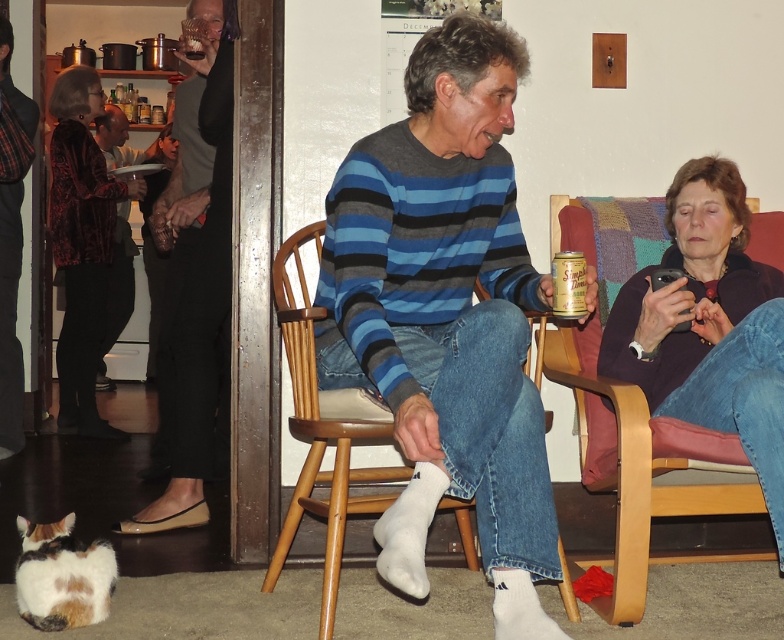
Can you confirm if purple soft sweater at right is positioned above shiny black shoes at lower left?

No.

Between purple soft sweater at right and shiny black shoes at lower left, which one is positioned higher?

shiny black shoes at lower left is higher up.

Where is `purple soft sweater at right`? The width and height of the screenshot is (784, 640). purple soft sweater at right is located at coordinates (708, 326).

Where is `purple soft sweater at right`? The height and width of the screenshot is (640, 784). purple soft sweater at right is located at coordinates (708, 326).

Who is more distant from viewer, (2, 72) or (115, 115)?

Point (115, 115)

In the scene shown: Who is positioned more to the left, dark gray flannel shirt at left or matte black sweater at left?

matte black sweater at left

The width and height of the screenshot is (784, 640). I want to click on dark gray flannel shirt at left, so pos(9,317).

Is blue striped sweater at center to the left of gold foil can at center from the viewer's perspective?

Indeed, blue striped sweater at center is positioned on the left side of gold foil can at center.

Who is shorter, blue striped sweater at center or gold foil can at center?

Standing shorter between the two is gold foil can at center.

Who is more distant from viewer, [423,404] or [576,266]?

Point [576,266]

The image size is (784, 640). Find the location of `blue striped sweater at center`. blue striped sweater at center is located at coordinates (445, 316).